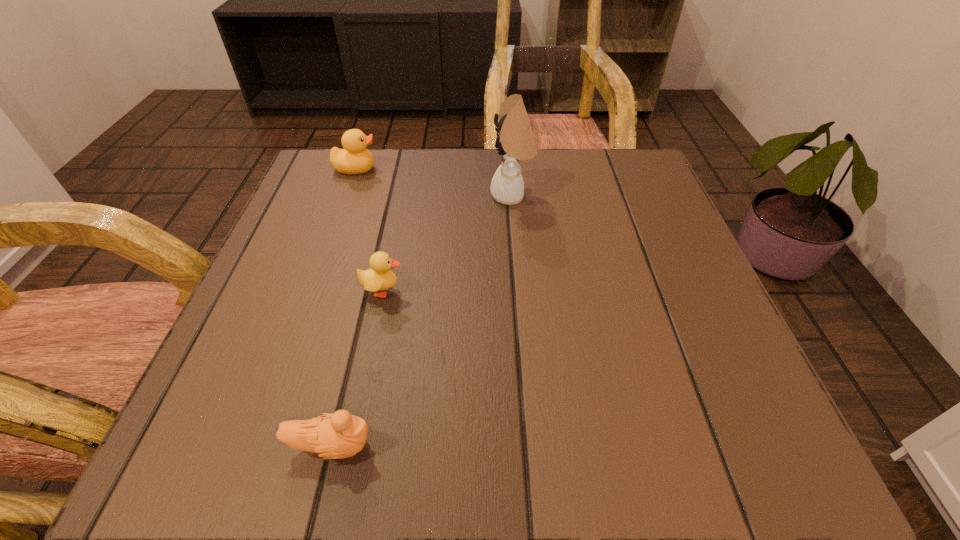
The image size is (960, 540). I want to click on vacant space at the far left corner, so click(x=378, y=175).

The width and height of the screenshot is (960, 540). Find the location of `vacant region at the far right corner of the desktop`. vacant region at the far right corner of the desktop is located at coordinates (599, 152).

This screenshot has width=960, height=540. In the image, there is a desktop. In order to click on vacant space at the near right corner in this screenshot , I will do `click(764, 462)`.

Identify the location of vacant point located between the second nearest object and the rightmost object. This screenshot has height=540, width=960. (447, 243).

At what (x,y) coordinates should I click in order to perform the action: click on free spot between the second nearest object and the farthest duckling. Please return your answer as a coordinate pair (x, y). Looking at the image, I should click on (370, 230).

Where is `unoccupied position between the nearest duckling and the farthest duckling`? The width and height of the screenshot is (960, 540). unoccupied position between the nearest duckling and the farthest duckling is located at coordinates (344, 307).

Identify the location of vacant area that lies between the second farthest duckling and the nearest duckling. Image resolution: width=960 pixels, height=540 pixels. coord(357,368).

This screenshot has height=540, width=960. Find the location of `free space between the nearest object and the farthest duckling`. free space between the nearest object and the farthest duckling is located at coordinates (344, 307).

Find the location of a particular element. This screenshot has width=960, height=540. vacant space in between the nearest duckling and the rightmost object is located at coordinates [421, 320].

This screenshot has width=960, height=540. I want to click on vacant region between the doll and the second nearest object, so click(447, 243).